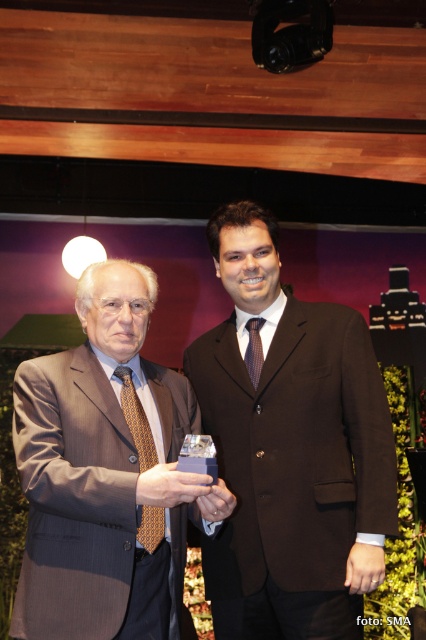
You are a photographer adjusting your camera focus. You have two points in your viewfinder labeled as point (221, 221) and point (68, 525). Which point should you focus on first to ensure the subject closest to the camera is sharp?

Point (221, 221) is closer to the camera than point (68, 525), so focus on point (221, 221) first to ensure the subject closest to the camera is sharp.